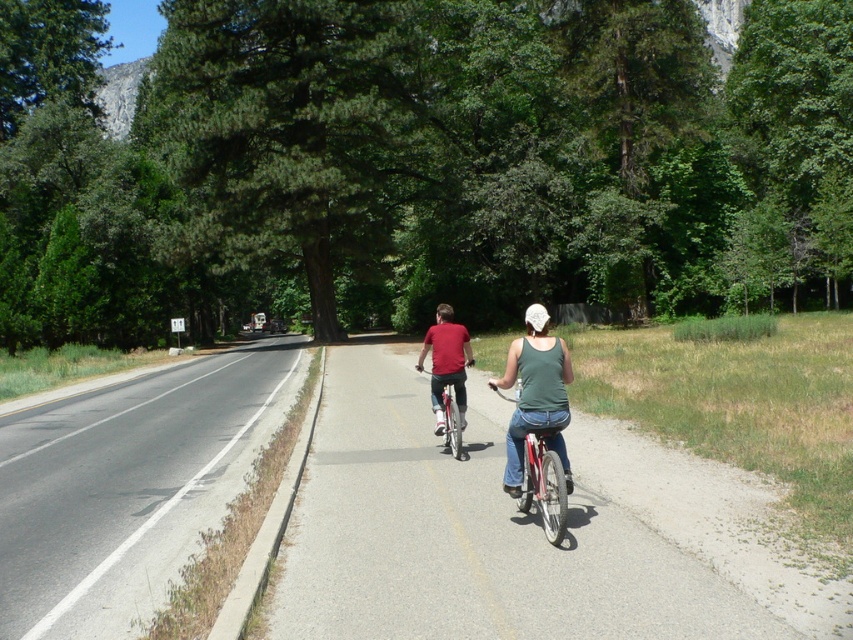
Is smooth asphalt bike path at center smaller than asphalt road at left?

Yes.

Can you confirm if smooth asphalt bike path at center is bigger than asphalt road at left?

Actually, smooth asphalt bike path at center might be smaller than asphalt road at left.

Between point (712, 600) and point (97, 568), which one is positioned behind?

Positioned behind is point (97, 568).

Locate an element on the screen. The image size is (853, 640). smooth asphalt bike path at center is located at coordinates coord(468,538).

Can you confirm if shiny metallic bicycle at center is shorter than white matte bicycle helmet at center?

Correct, shiny metallic bicycle at center is not as tall as white matte bicycle helmet at center.

Does point (419, 369) come closer to viewer compared to point (538, 305)?

Yes.

Between point (447, 410) and point (537, 328), which one is positioned in front?

Point (537, 328)

I want to click on shiny metallic bicycle at center, so click(x=450, y=416).

Consider the image. Which of these two, smooth asphalt bike path at center or shiny metallic bicycle at center, stands shorter?

smooth asphalt bike path at center

Between point (334, 460) and point (445, 381), which one is positioned in front?

Point (334, 460) is more forward.

The height and width of the screenshot is (640, 853). Identify the location of smooth asphalt bike path at center. (468, 538).